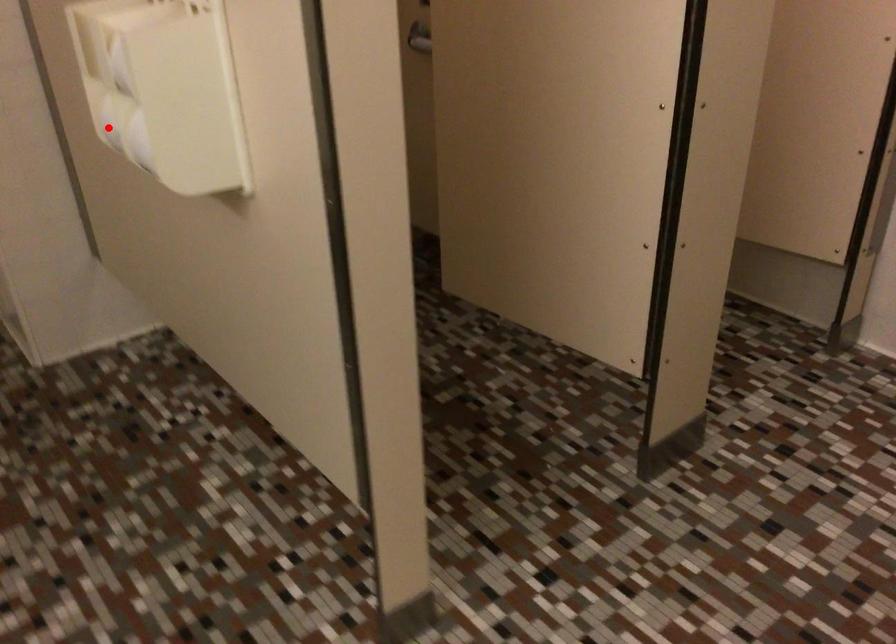
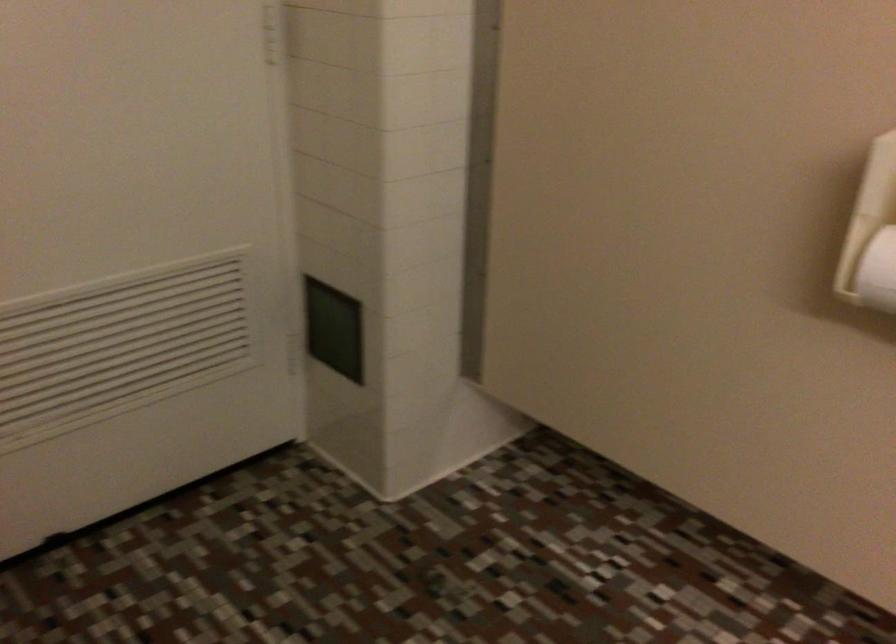
Where in the second image is the point corresponding to the highlighted location from the first image?

(876, 272)